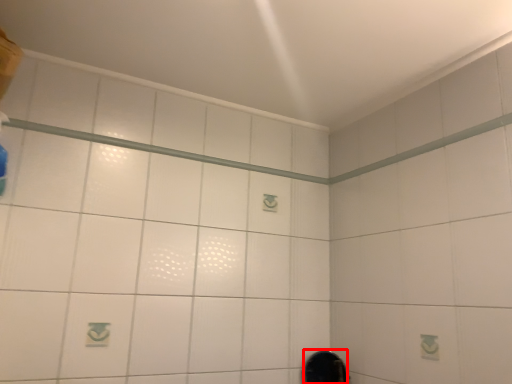
Question: From the image's perspective, what is the correct spatial positioning of mirror (annotated by the red box) in reference to shower?

Choices:
 (A) above
 (B) below

Answer: (B)